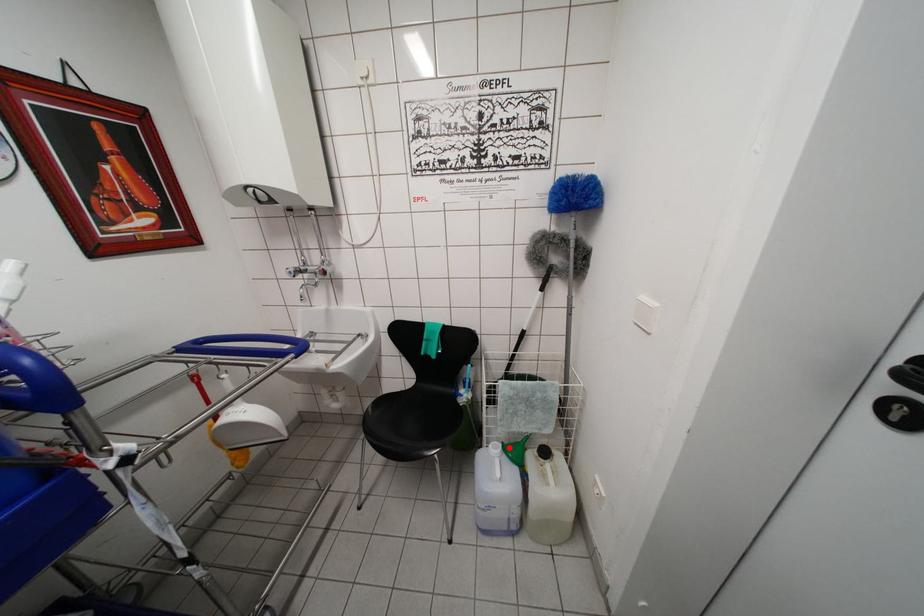
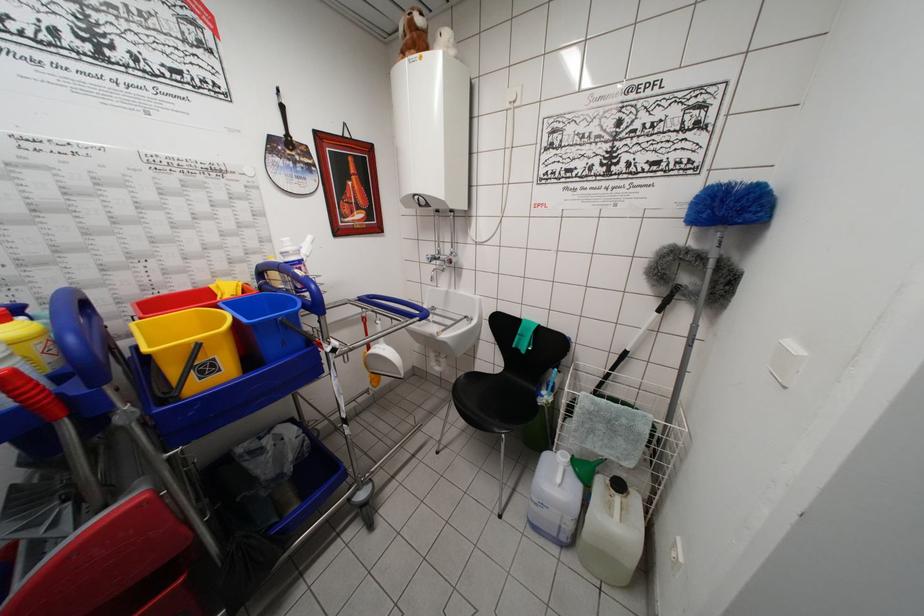
Question: I am providing you with two images of the same scene from different viewpoints. Given a red point in image1, look at the same physical point in image2. Is it:

Choices:
 (A) Closer to the viewpoint
 (B) Farther from the viewpoint

Answer: (A)